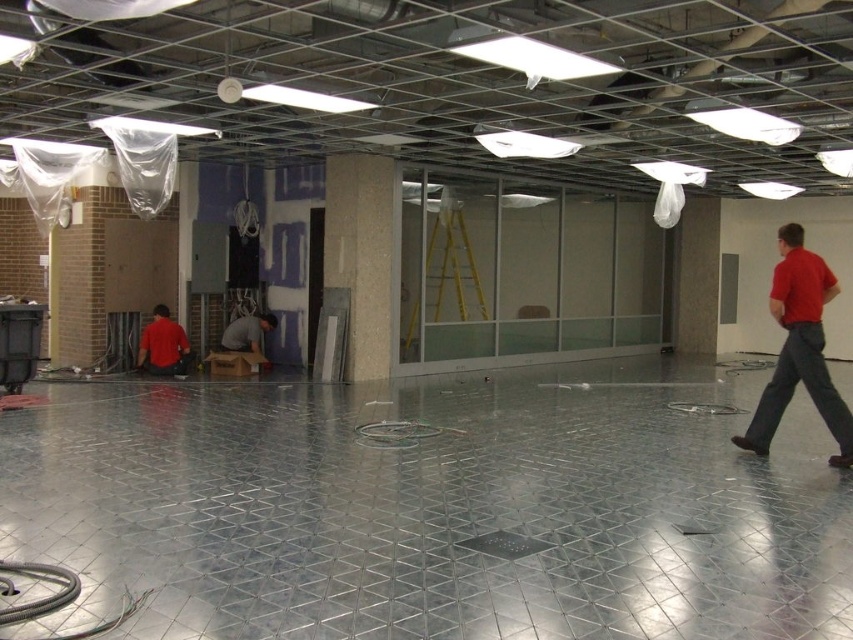
In the scene shown: Is matte red shirt at left shorter than gray fabric shirt at center?

No, matte red shirt at left is not shorter than gray fabric shirt at center.

Who is positioned more to the right, matte red shirt at left or gray fabric shirt at center?

gray fabric shirt at center

Who is more forward, (148,339) or (254,349)?

Point (148,339)

This screenshot has height=640, width=853. Find the location of `matte red shirt at left`. matte red shirt at left is located at coordinates (161, 342).

How distant is red cotton shirt at right from matte red shirt at left?

7.63 meters

Is red cotton shirt at right bigger than matte red shirt at left?

Yes, red cotton shirt at right is bigger than matte red shirt at left.

You are a GUI agent. You are given a task and a screenshot of the screen. Output one action in this format:
    pyautogui.click(x=<x>, y=<y>)
    Task: Click on the red cotton shirt at right
    The image size is (853, 640).
    Given the screenshot: What is the action you would take?
    (x=799, y=348)

At what (x,y) coordinates should I click in order to perform the action: click on red cotton shirt at right. Please return your answer as a coordinate pair (x, y). The image size is (853, 640). Looking at the image, I should click on (799, 348).

Does red cotton shirt at right have a lesser height compared to gray fabric shirt at center?

No.

Who is positioned more to the left, red cotton shirt at right or gray fabric shirt at center?

From the viewer's perspective, gray fabric shirt at center appears more on the left side.

Who is more forward, (811, 371) or (242, 316)?

Point (811, 371) is in front.

The width and height of the screenshot is (853, 640). Identify the location of red cotton shirt at right. (799, 348).